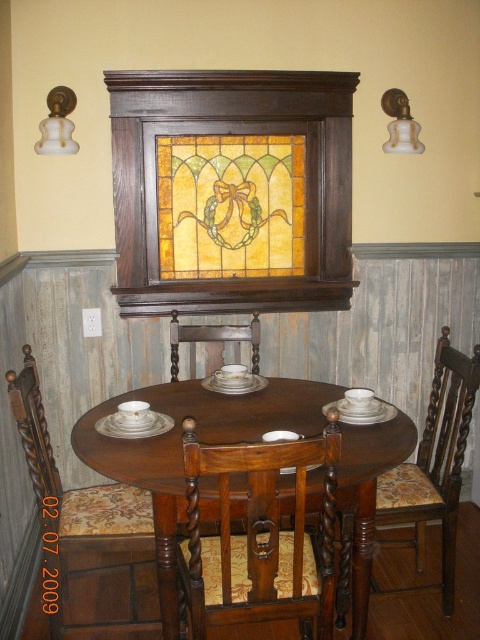
Question: Considering the real-world distances, which object is closest to the floral fabric chair at lower left?

Choices:
 (A) brown wood chair at center
 (B) wooden chair with floral upholstery at lower right

Answer: (A)

Question: Can you confirm if stained glass at center is bigger than brown wood chair at center?

Choices:
 (A) yes
 (B) no

Answer: (A)

Question: Estimate the real-world distances between objects in this image. Which object is farther from the wooden chair at center?

Choices:
 (A) floral fabric chair at lower left
 (B) stained glass at center
 (C) mahogany wood table at center
 (D) wooden chair with floral upholstery at lower right

Answer: (B)

Question: Does mahogany wood table at center appear over brown wood chair at center?

Choices:
 (A) no
 (B) yes

Answer: (A)

Question: Does mahogany wood table at center have a lesser width compared to floral fabric chair at lower left?

Choices:
 (A) yes
 (B) no

Answer: (B)

Question: Among these points, which one is farthest from the camera?

Choices:
 (A) (259, 365)
 (B) (132, 538)
 (C) (194, 561)

Answer: (A)